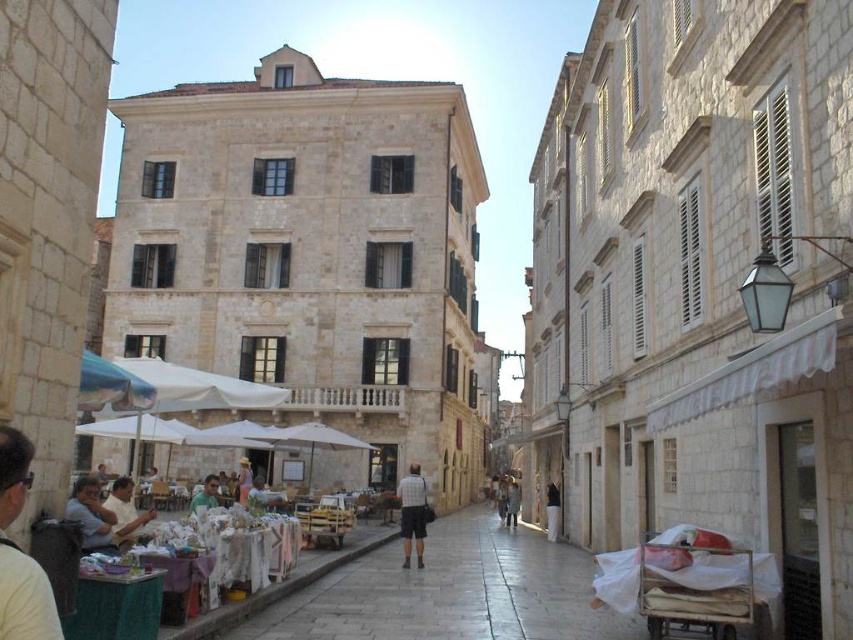
Identify the location of light brown wooden chair at center. Image resolution: width=853 pixels, height=640 pixels. (264, 497).

Can you confirm if light brown wooden chair at center is thinner than light blue shirt at center?

Indeed, light brown wooden chair at center has a lesser width compared to light blue shirt at center.

The width and height of the screenshot is (853, 640). Find the location of `light brown wooden chair at center`. light brown wooden chair at center is located at coordinates (264, 497).

The image size is (853, 640). Identify the location of light brown wooden chair at center. (264, 497).

This screenshot has width=853, height=640. In order to click on white cotton shirt at center in this screenshot , I will do `click(125, 512)`.

Can you confirm if white cotton shirt at center is shorter than light brown wooden chair at center?

In fact, white cotton shirt at center may be taller than light brown wooden chair at center.

Between point (120, 486) and point (267, 490), which one is positioned behind?

Positioned behind is point (267, 490).

In order to click on white cotton shirt at center in this screenshot , I will do `click(125, 512)`.

Does smooth stone pavement at center have a lesser height compared to light blue shirt at center?

No, smooth stone pavement at center is not shorter than light blue shirt at center.

Does point (590, 624) lie behind point (207, 484)?

No.

Between point (428, 544) and point (206, 492), which one is positioned in front?

Point (206, 492)

Identify the location of smooth stone pavement at center. The width and height of the screenshot is (853, 640). (451, 593).